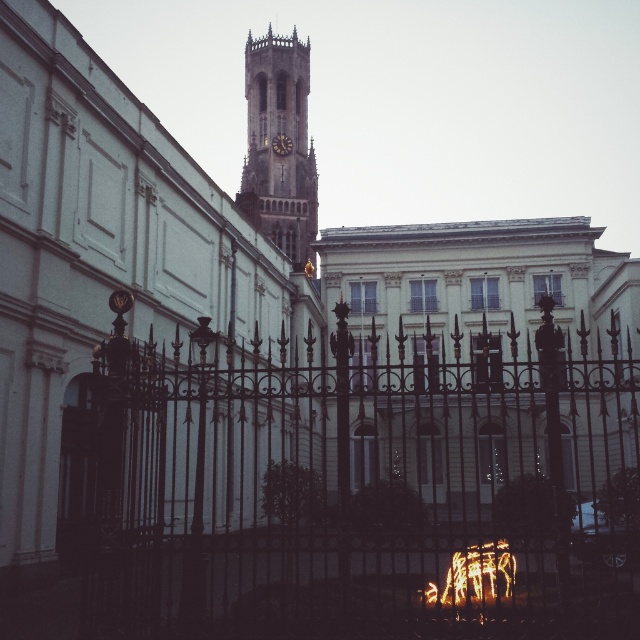
Between black wrought iron gate at center and brown stone clock tower at center, which one is positioned higher?

brown stone clock tower at center

Based on the photo, how distant is black wrought iron gate at center from brown stone clock tower at center?

black wrought iron gate at center and brown stone clock tower at center are 215.69 feet apart from each other.

Where is `black wrought iron gate at center`? black wrought iron gate at center is located at coordinates (362, 484).

Who is shorter, black wrought iron gate at center or dark brown wooden clock at center?

dark brown wooden clock at center

Can you confirm if black wrought iron gate at center is taller than dark brown wooden clock at center?

Correct, black wrought iron gate at center is much taller as dark brown wooden clock at center.

The image size is (640, 640). What do you see at coordinates (362, 484) in the screenshot? I see `black wrought iron gate at center` at bounding box center [362, 484].

This screenshot has width=640, height=640. Identify the location of black wrought iron gate at center. (362, 484).

What do you see at coordinates (272, 148) in the screenshot? This screenshot has height=640, width=640. I see `brown stone clock tower at center` at bounding box center [272, 148].

I want to click on brown stone clock tower at center, so click(272, 148).